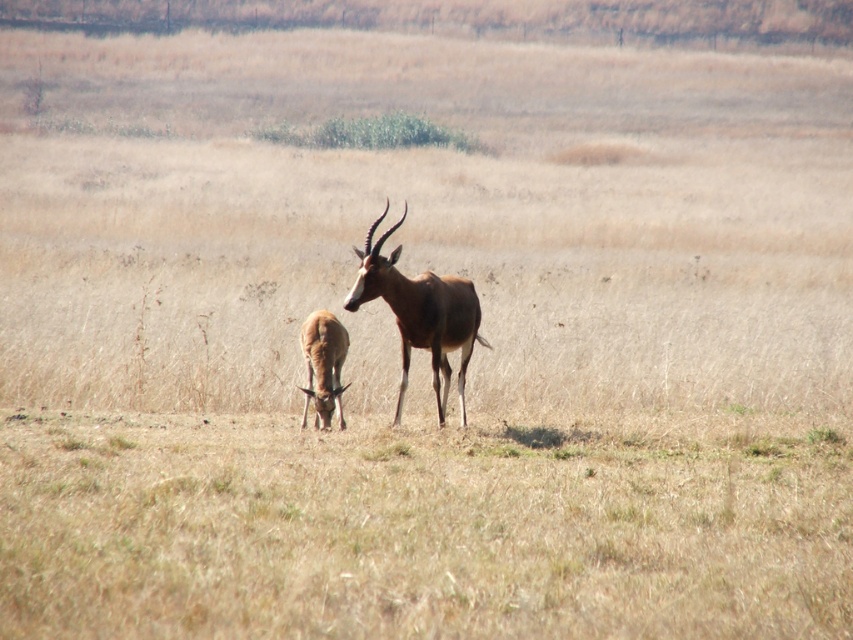
Question: Is brown glossy antelope at center behind brown smooth antelope at lower left?

Choices:
 (A) yes
 (B) no

Answer: (B)

Question: Can you confirm if brown glossy antelope at center is smaller than brown smooth antelope at lower left?

Choices:
 (A) yes
 (B) no

Answer: (B)

Question: Which point is closer to the camera?

Choices:
 (A) brown smooth antelope at lower left
 (B) brown glossy antelope at center

Answer: (B)

Question: Is brown glossy antelope at center above brown smooth antelope at lower left?

Choices:
 (A) yes
 (B) no

Answer: (A)